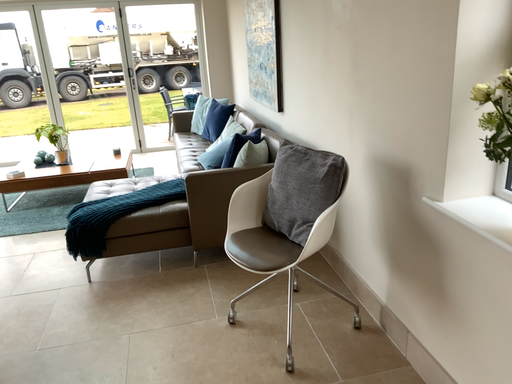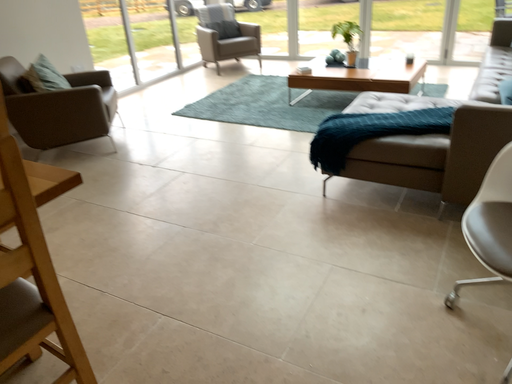
Question: Which way did the camera rotate in the video?

Choices:
 (A) rotated right
 (B) rotated left

Answer: (B)